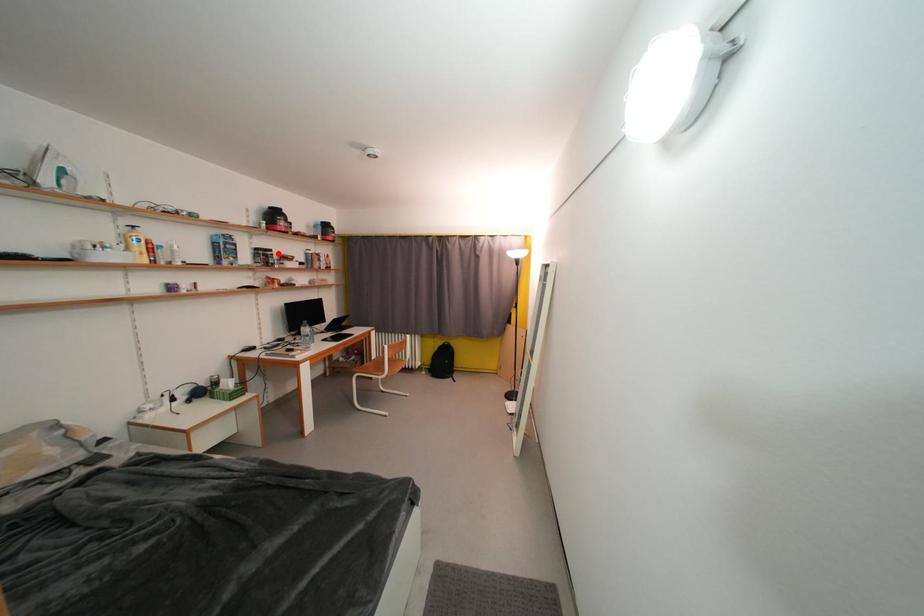
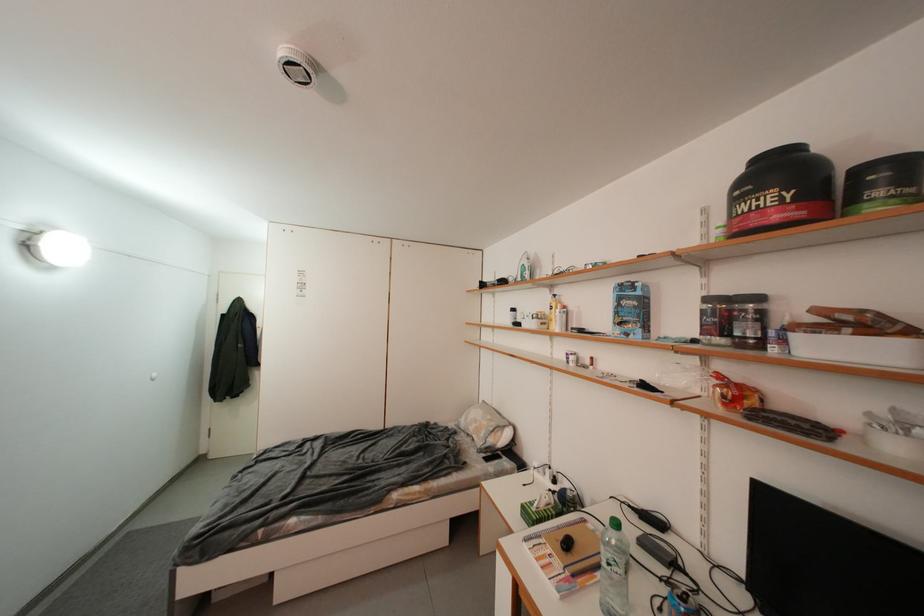
Find the pixel in the second image that matches the highlighted location in the first image.

(766, 301)